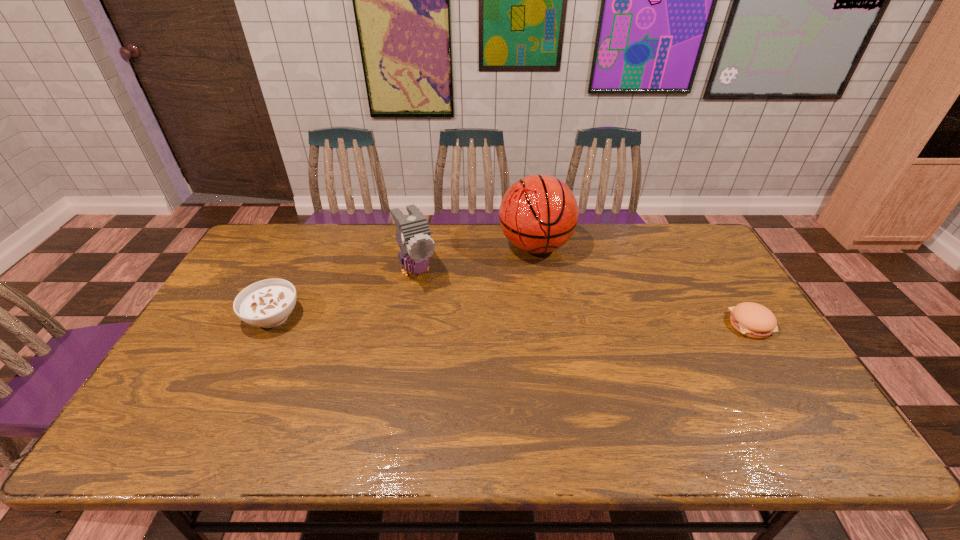
You are a GUI agent. You are given a task and a screenshot of the screen. Output one action in this format:
    pyautogui.click(x=<x>, y=<y>)
    Task: Click on the vacant spot on the desktop that is between the leftmost object and the rightmost object and is positioned at the beak of the second tallest object
    This screenshot has width=960, height=540.
    Given the screenshot: What is the action you would take?
    pyautogui.click(x=444, y=320)

The image size is (960, 540). In order to click on free space on the desktop that is between the leftmost object and the patty and is positioned on the side with spill of the basketball in this screenshot , I will do `click(545, 321)`.